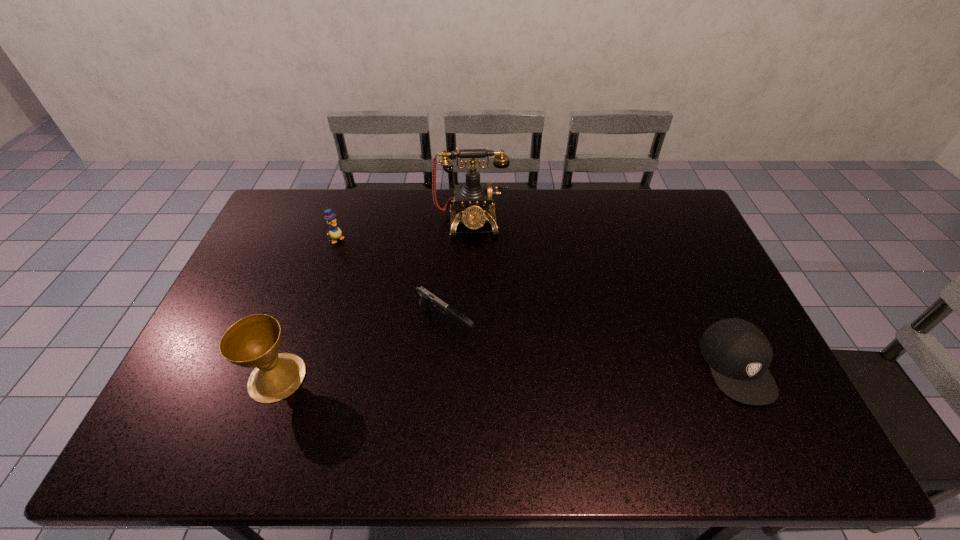
This screenshot has height=540, width=960. I want to click on free space located at the muzzle end of the shortest object, so click(x=571, y=410).

I want to click on vacant area situated 0.290m at the muzzle end of the shortest object, so click(x=554, y=399).

At what (x,y) coordinates should I click in order to perform the action: click on free space located on the front of the tallest object, featuring the rotary dial. Please return your answer as a coordinate pair (x, y). The height and width of the screenshot is (540, 960). Looking at the image, I should click on (476, 323).

Locate an element on the screen. The width and height of the screenshot is (960, 540). free spot located on the front of the tallest object, featuring the rotary dial is located at coordinates (474, 287).

The width and height of the screenshot is (960, 540). Find the location of `vacant space located 0.120m on the front of the tallest object, featuring the rotary dial`. vacant space located 0.120m on the front of the tallest object, featuring the rotary dial is located at coordinates (473, 264).

Locate an element on the screen. object situated at the far edge is located at coordinates (473, 197).

Locate an element on the screen. chalice that is at the near edge is located at coordinates (254, 341).

Image resolution: width=960 pixels, height=540 pixels. Find the location of `cap located in the near edge section of the desktop`. cap located in the near edge section of the desktop is located at coordinates [738, 353].

The image size is (960, 540). What are the coordinates of `object located in the right edge section of the desktop` in the screenshot? It's located at [x=738, y=353].

Find the location of a particular element. object that is at the near right corner is located at coordinates click(738, 353).